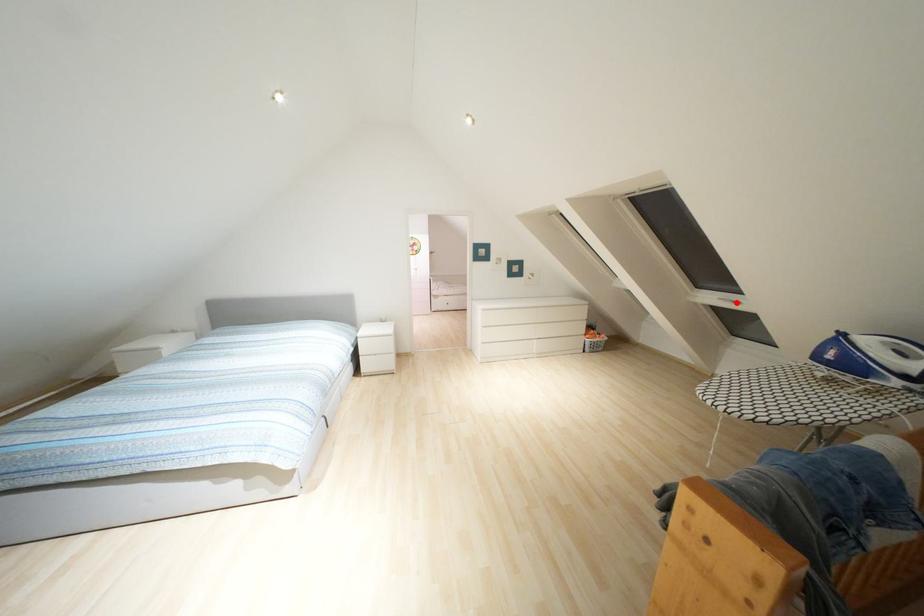
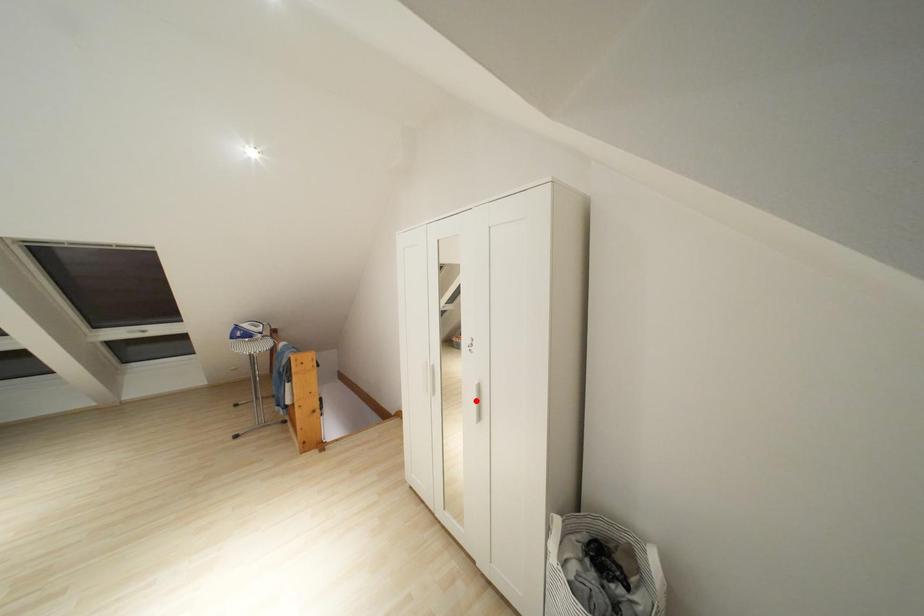
I am providing you with two images of the same scene from different viewpoints. A red point is marked on the first image and another point is marked on the second image. Does the point marked in image1 correspond to the same location as the one in image2?

No